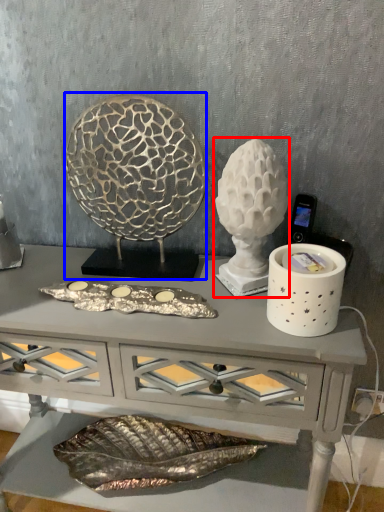
Question: Which point is further to the camera, sculpture (highlighted by a red box) or sculpture (highlighted by a blue box)?

Choices:
 (A) sculpture
 (B) sculpture

Answer: (B)